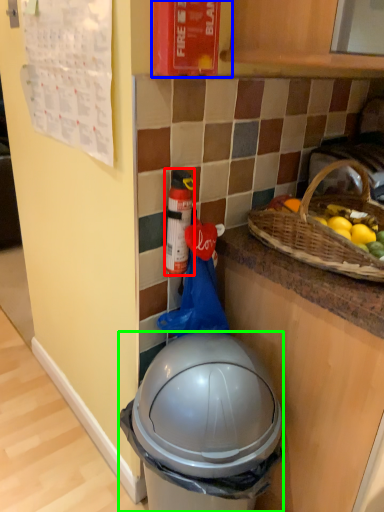
Question: Which object is the closest to the bottle (highlighted by a red box)? Choose among these: fire extinguisher (highlighted by a blue box) or trash bin/can (highlighted by a green box).

Choices:
 (A) fire extinguisher
 (B) trash bin/can

Answer: (A)